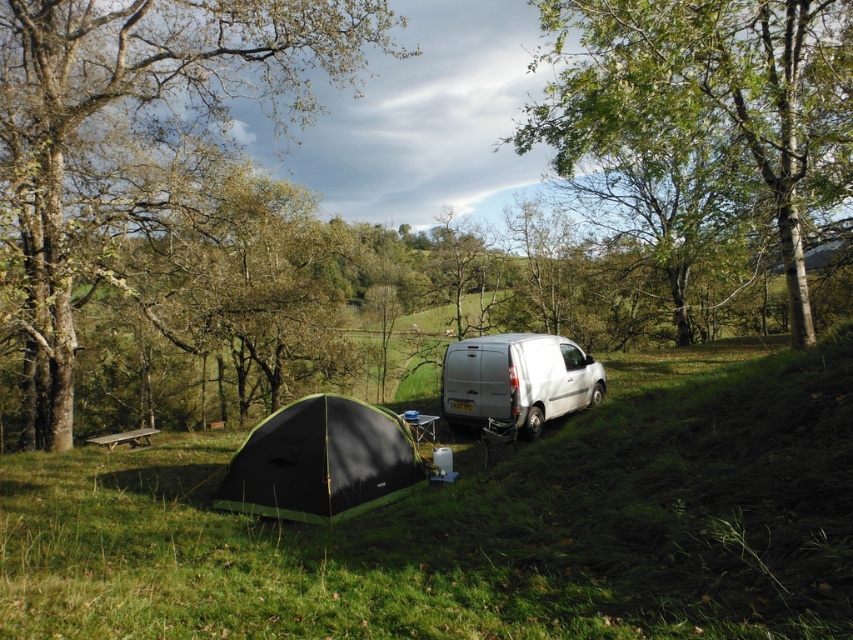
Does green grassy at lower left have a larger size compared to green leafy tree at upper center?

No, green grassy at lower left is not bigger than green leafy tree at upper center.

Consider the image. Who is positioned more to the left, green grassy at lower left or green leafy tree at upper center?

green grassy at lower left

You are a GUI agent. You are given a task and a screenshot of the screen. Output one action in this format:
    pyautogui.click(x=<x>, y=<y>)
    Task: Click on the green grassy at lower left
    The height and width of the screenshot is (640, 853).
    Given the screenshot: What is the action you would take?
    pyautogui.click(x=474, y=529)

Measure the distance from green grassy at lower left to black fabric tent at lower left.

green grassy at lower left is 1.68 meters from black fabric tent at lower left.

Does green grassy at lower left have a lesser width compared to black fabric tent at lower left?

In fact, green grassy at lower left might be wider than black fabric tent at lower left.

At what (x,y) coordinates should I click in order to perform the action: click on green grassy at lower left. Please return your answer as a coordinate pair (x, y). The width and height of the screenshot is (853, 640). Looking at the image, I should click on (474, 529).

Is green grassy at lower left wider than brown rough tree at left?

No.

Between green grassy at lower left and brown rough tree at left, which one is positioned higher?

brown rough tree at left is above.

Where is `green grassy at lower left`? The image size is (853, 640). green grassy at lower left is located at coordinates (474, 529).